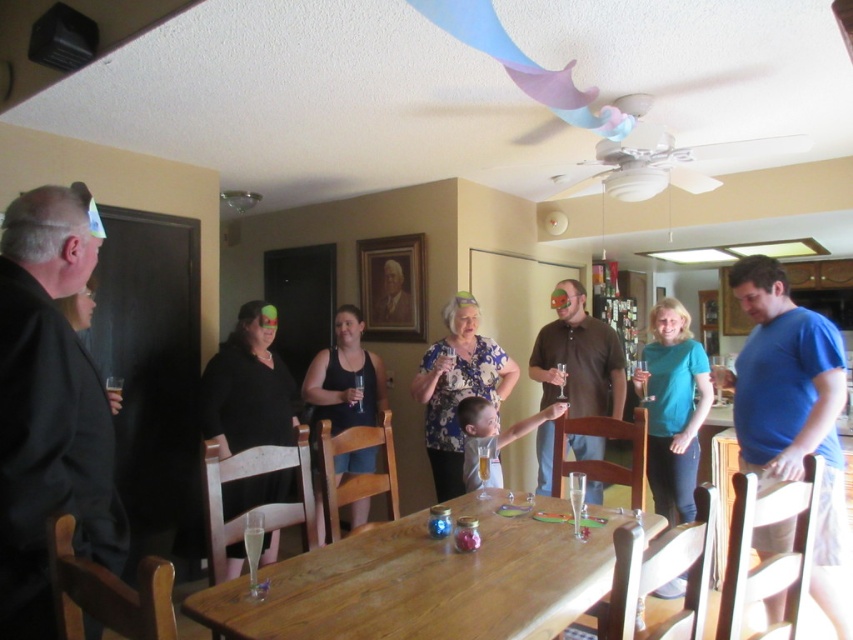
Question: Is wooden table at center thinner than dark gray suit at left?

Choices:
 (A) yes
 (B) no

Answer: (B)

Question: Can you confirm if black matte mask at left is positioned above floral fabric dress at center?

Choices:
 (A) yes
 (B) no

Answer: (B)

Question: Estimate the real-world distances between objects in this image. Which object is farther from the brown cotton shirt at center?

Choices:
 (A) dark gray suit at left
 (B) wooden table at center
 (C) blue cotton t-shirt at right

Answer: (A)

Question: Where is blue cotton t-shirt at right located in relation to floral fabric dress at center in the image?

Choices:
 (A) right
 (B) left

Answer: (A)

Question: Which point is farther from the camera taking this photo?

Choices:
 (A) (468, 352)
 (B) (349, 506)

Answer: (B)

Question: Which of the following is the closest to the observer?

Choices:
 (A) floral fabric dress at center
 (B) wooden table at center

Answer: (B)